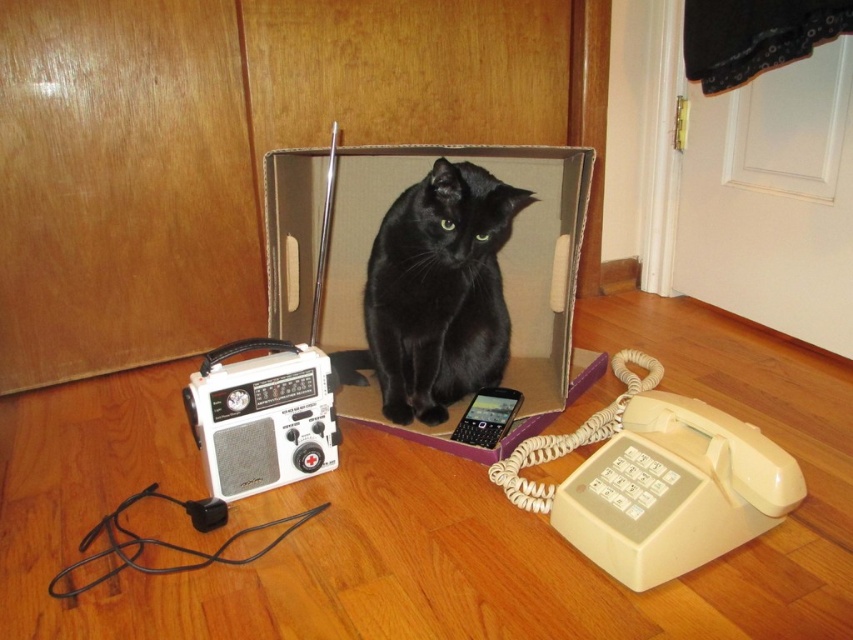
From the picture: You are standing at the entrance of the room and want to place a new plant pot between the two points marked as point (364, 148) and point (440, 333). Which point should the plant pot be closer to if you want it to be closer to the entrance?

The plant pot should be closer to point (364, 148) because it is in front of point (440, 333) from the entrance perspective.